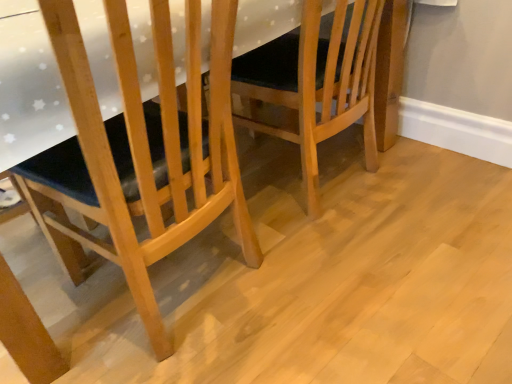
Question: Which direction should I rotate to look at light brown wooden chair at center, which is the 1th chair from right to left, — up or down?

Choices:
 (A) down
 (B) up

Answer: (B)

Question: Can you confirm if natural wood chair at left, the 2th chair from the right, is bigger than light brown wooden chair at center, which is the 1th chair from right to left?

Choices:
 (A) no
 (B) yes

Answer: (B)

Question: Can you confirm if natural wood chair at left, acting as the 1th chair starting from the left, is thinner than light brown wooden chair at center, placed as the second chair when sorted from left to right?

Choices:
 (A) no
 (B) yes

Answer: (B)

Question: Is the surface of natural wood chair at left, acting as the 1th chair starting from the left, in direct contact with light brown wooden chair at center, placed as the second chair when sorted from left to right?

Choices:
 (A) yes
 (B) no

Answer: (B)

Question: Is natural wood chair at left, the 2th chair from the right, outside light brown wooden chair at center, placed as the second chair when sorted from left to right?

Choices:
 (A) yes
 (B) no

Answer: (A)

Question: Is natural wood chair at left, the 2th chair from the right, wider than light brown wooden chair at center, placed as the second chair when sorted from left to right?

Choices:
 (A) no
 (B) yes

Answer: (A)

Question: Would you consider natural wood chair at left, acting as the 1th chair starting from the left, to be distant from light brown wooden chair at center, placed as the second chair when sorted from left to right?

Choices:
 (A) yes
 (B) no

Answer: (B)

Question: Considering the relative sizes of light brown wooden chair at center, placed as the second chair when sorted from left to right, and natural wood chair at left, acting as the 1th chair starting from the left, in the image provided, is light brown wooden chair at center, placed as the second chair when sorted from left to right, bigger than natural wood chair at left, acting as the 1th chair starting from the left,?

Choices:
 (A) no
 (B) yes

Answer: (A)

Question: Is light brown wooden chair at center, placed as the second chair when sorted from left to right, completely or partially outside of natural wood chair at left, the 2th chair from the right?

Choices:
 (A) no
 (B) yes

Answer: (B)

Question: Is light brown wooden chair at center, placed as the second chair when sorted from left to right, far from natural wood chair at left, the 2th chair from the right?

Choices:
 (A) yes
 (B) no

Answer: (B)

Question: Is light brown wooden chair at center, placed as the second chair when sorted from left to right, to the right of natural wood chair at left, the 2th chair from the right, from the viewer's perspective?

Choices:
 (A) no
 (B) yes

Answer: (B)

Question: Is light brown wooden chair at center, placed as the second chair when sorted from left to right, shorter than natural wood chair at left, the 2th chair from the right?

Choices:
 (A) no
 (B) yes

Answer: (B)

Question: From a real-world perspective, is light brown wooden chair at center, placed as the second chair when sorted from left to right, positioned under natural wood chair at left, acting as the 1th chair starting from the left, based on gravity?

Choices:
 (A) no
 (B) yes

Answer: (B)

Question: Does point (258, 122) appear closer or farther from the camera than point (176, 167)?

Choices:
 (A) farther
 (B) closer

Answer: (A)